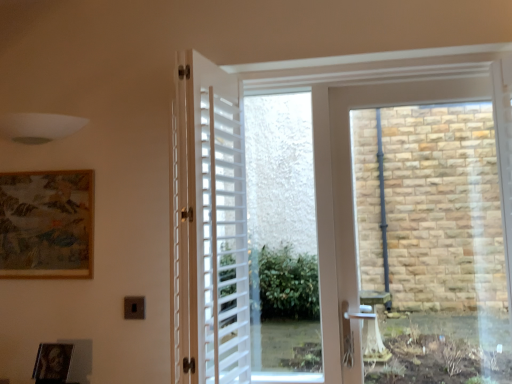
Question: Considering the positions of black matte picture frame at lower left, the 1th picture frame from the front, and white matte shutter at center in the image, is black matte picture frame at lower left, the 1th picture frame from the front, wider or thinner than white matte shutter at center?

Choices:
 (A) wide
 (B) thin

Answer: (B)

Question: In the image, is black matte picture frame at lower left, the 1th picture frame from the front, positioned in front of or behind white matte shutter at center?

Choices:
 (A) behind
 (B) front

Answer: (A)

Question: Which of these objects is positioned closest to the white plastic window screen at center?

Choices:
 (A) wooden textured picture frame at upper left, the second picture frame from the front
 (B) black matte picture frame at lower left, the 1th picture frame from the front
 (C) white matte shutter at center

Answer: (C)

Question: Which object is positioned farthest from the white matte shutter at center?

Choices:
 (A) black matte picture frame at lower left, the second picture frame viewed from the top
 (B) wooden textured picture frame at upper left, the second picture frame from the bottom
 (C) white plastic window screen at center

Answer: (C)